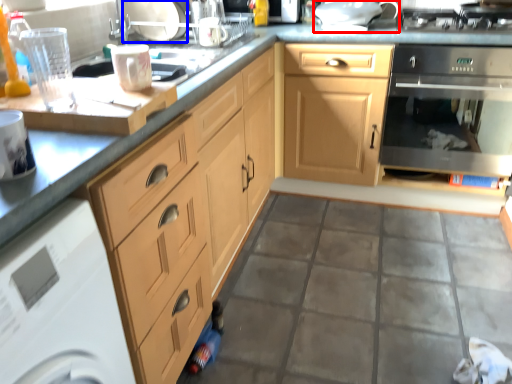
Question: Which object is further to the camera taking this photo, appliance (highlighted by a red box) or appliance (highlighted by a blue box)?

Choices:
 (A) appliance
 (B) appliance

Answer: (A)